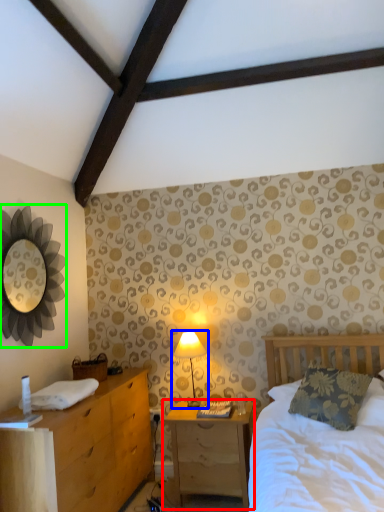
Question: Based on their relative distances, which object is nearer to nightstand (highlighted by a red box)? Choose from table lamp (highlighted by a blue box) and mirror (highlighted by a green box).

Choices:
 (A) table lamp
 (B) mirror

Answer: (A)